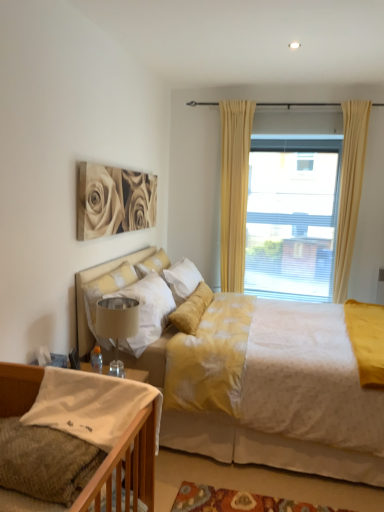
Locate an element on the screen. Image resolution: width=384 pixels, height=512 pixels. blank space above translucent glass window at upper center (from a real-world perspective) is located at coordinates click(284, 102).